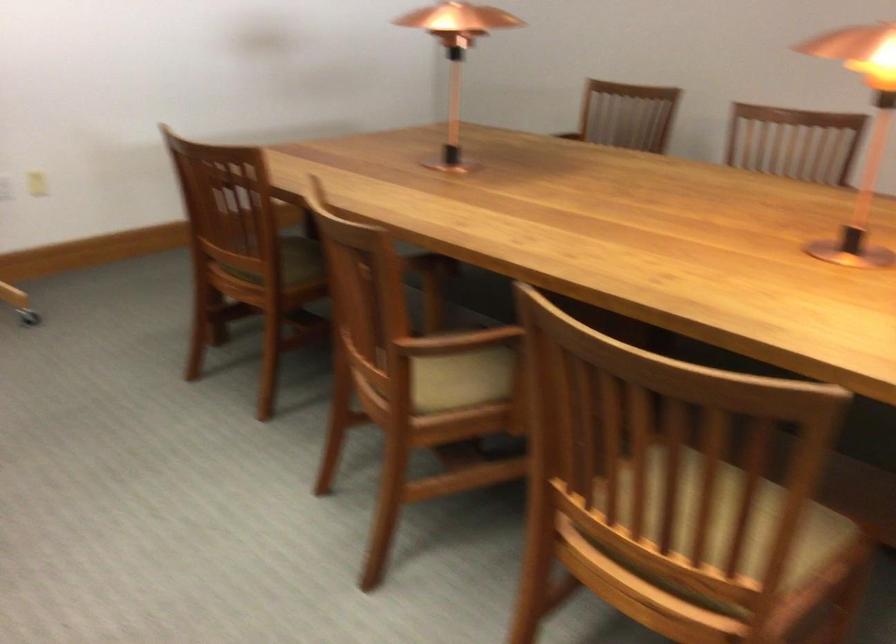
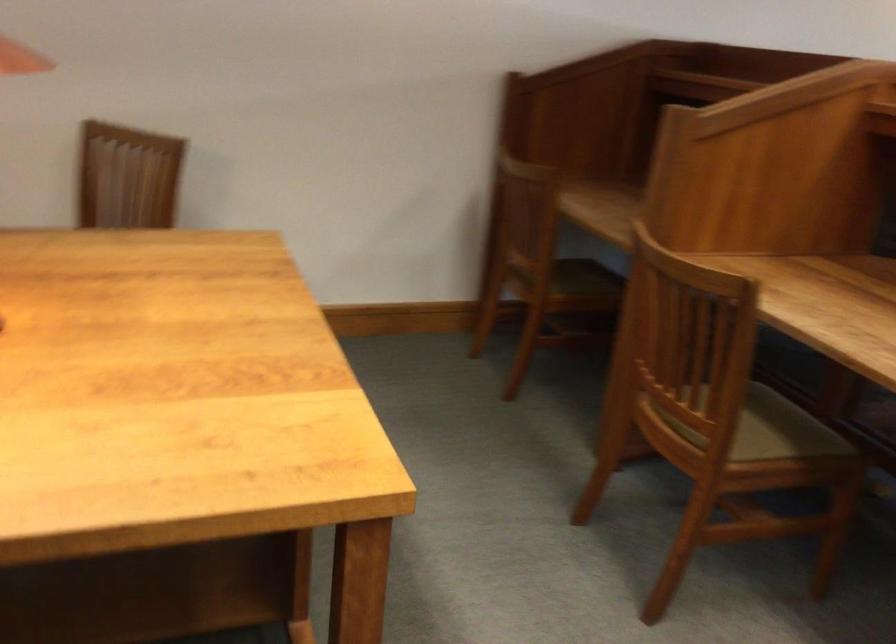
Question: The camera is either moving clockwise (left) or counter-clockwise (right) around the object. The first image is from the beginning of the video and the second image is from the end. Is the camera moving left or right when shooting the video?

Choices:
 (A) Left
 (B) Right

Answer: (A)